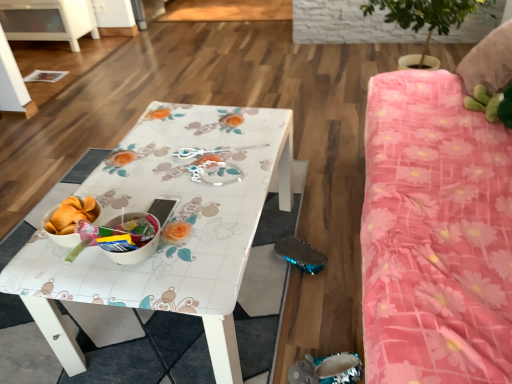
Question: Is pink floral fabric bed at right with white glossy table at center?

Choices:
 (A) yes
 (B) no

Answer: (B)

Question: Can you confirm if pink floral fabric bed at right is bigger than white glossy table at center?

Choices:
 (A) yes
 (B) no

Answer: (A)

Question: Is pink floral fabric bed at right further to camera compared to white glossy table at center?

Choices:
 (A) yes
 (B) no

Answer: (B)

Question: From a real-world perspective, does pink floral fabric bed at right stand above white glossy table at center?

Choices:
 (A) no
 (B) yes

Answer: (B)

Question: Is pink floral fabric bed at right thinner than white glossy table at center?

Choices:
 (A) no
 (B) yes

Answer: (B)

Question: Relative to pink floral fabric bed at right, is white glossy table at center in front or behind?

Choices:
 (A) front
 (B) behind

Answer: (B)

Question: Based on their sizes in the image, would you say white glossy table at center is bigger or smaller than pink floral fabric bed at right?

Choices:
 (A) small
 (B) big

Answer: (A)

Question: Considering the positions of white glossy table at center and pink floral fabric bed at right in the image, is white glossy table at center wider or thinner than pink floral fabric bed at right?

Choices:
 (A) thin
 (B) wide

Answer: (B)

Question: From a real-world perspective, relative to pink floral fabric bed at right, is white glossy table at center vertically above or below?

Choices:
 (A) below
 (B) above

Answer: (A)

Question: Is clear plastic spoon at center in front of or behind pink floral fabric bed at right in the image?

Choices:
 (A) front
 (B) behind

Answer: (B)

Question: From a real-world perspective, is clear plastic spoon at center physically located above or below pink floral fabric bed at right?

Choices:
 (A) above
 (B) below

Answer: (A)

Question: In terms of size, does clear plastic spoon at center appear bigger or smaller than pink floral fabric bed at right?

Choices:
 (A) small
 (B) big

Answer: (A)

Question: Is clear plastic spoon at center wider or thinner than pink floral fabric bed at right?

Choices:
 (A) thin
 (B) wide

Answer: (A)

Question: Visually, is clear plastic spoon at center positioned to the left or to the right of white glossy table at center?

Choices:
 (A) left
 (B) right

Answer: (B)

Question: From a real-world perspective, relative to white glossy table at center, is clear plastic spoon at center vertically above or below?

Choices:
 (A) above
 (B) below

Answer: (A)